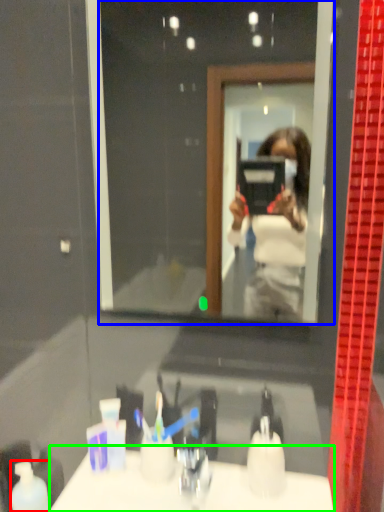
Question: Which object is the farthest from mouthwash (highlighted by a red box)? Choose among these: mirror (highlighted by a blue box) or counter top (highlighted by a green box).

Choices:
 (A) mirror
 (B) counter top

Answer: (A)